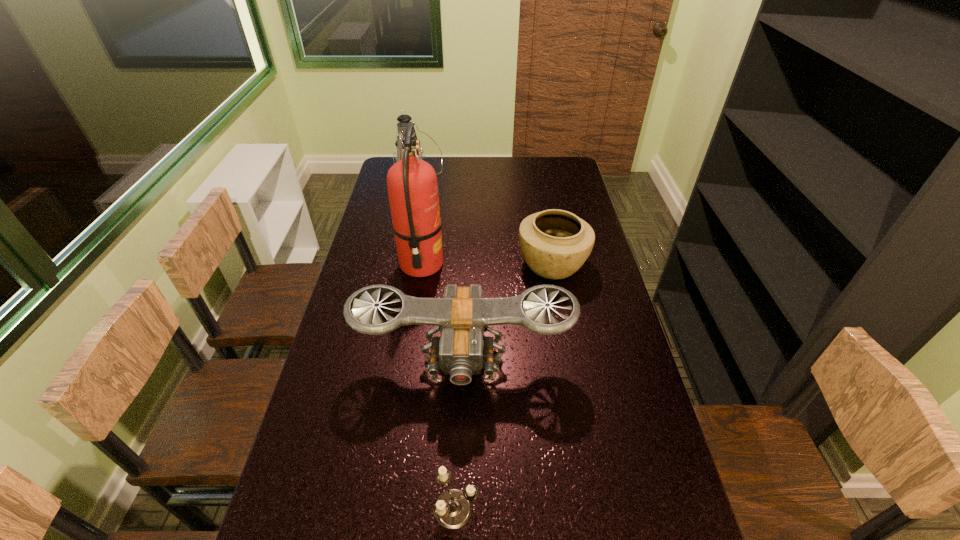
This screenshot has width=960, height=540. In order to click on free space at the left edge in this screenshot , I will do `click(398, 262)`.

At what (x,y) coordinates should I click in order to perform the action: click on free space at the right edge of the desktop. Please return your answer as a coordinate pair (x, y). Looking at the image, I should click on (575, 199).

Where is `free space at the far left corner of the desktop`? free space at the far left corner of the desktop is located at coordinates (386, 172).

This screenshot has height=540, width=960. Identify the location of vacant space at the far right corner of the desktop. (569, 163).

Find the location of a particular element. Image resolution: width=960 pixels, height=540 pixels. blank region between the candle holder and the fourth tallest object is located at coordinates (504, 386).

Where is `free space between the fourth shortest object and the pottery`? The width and height of the screenshot is (960, 540). free space between the fourth shortest object and the pottery is located at coordinates (485, 227).

Locate an element on the screen. vacant space that is in between the tallest object and the nearest object is located at coordinates (439, 387).

This screenshot has height=540, width=960. I want to click on vacant region between the fire extinguisher and the candle holder, so click(439, 387).

At what (x,y) coordinates should I click in order to perform the action: click on unoccupied position between the second nearest object and the nearest object. Please return your answer as a coordinate pair (x, y). The image size is (960, 540). Looking at the image, I should click on (460, 436).

Locate an element on the screen. This screenshot has height=540, width=960. empty space between the farthest object and the pottery is located at coordinates (485, 227).